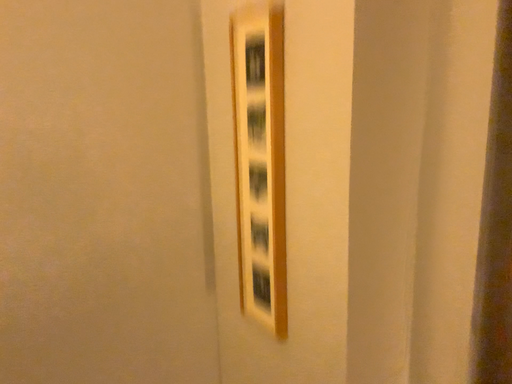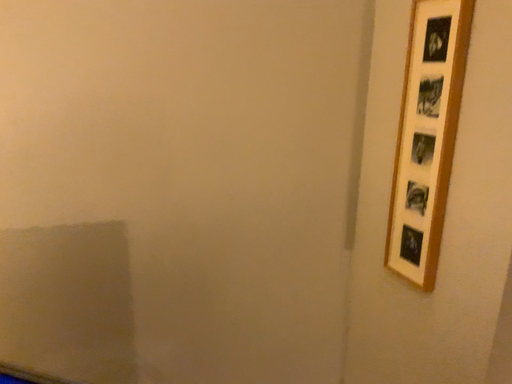
Question: How did the camera likely rotate when shooting the video?

Choices:
 (A) rotated right
 (B) rotated left

Answer: (B)